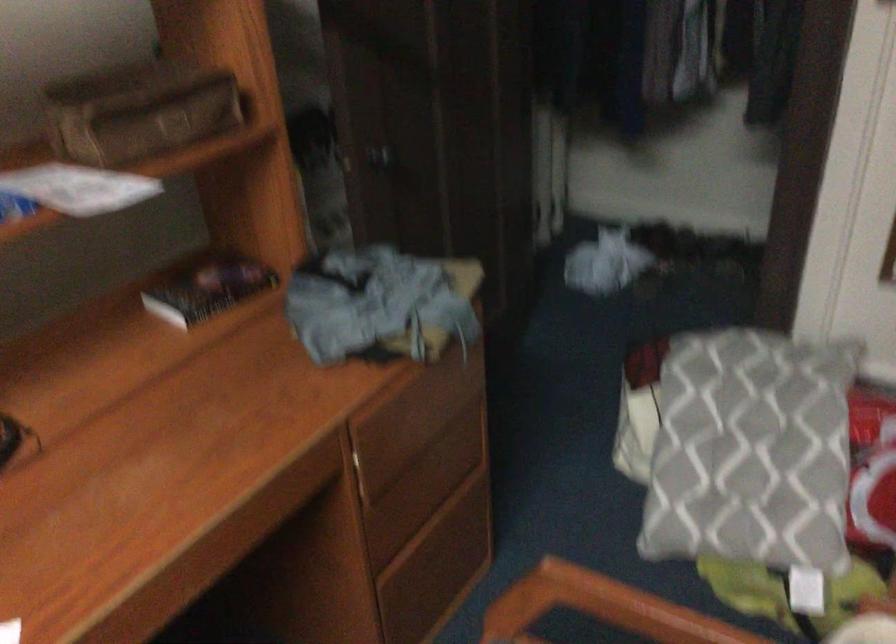
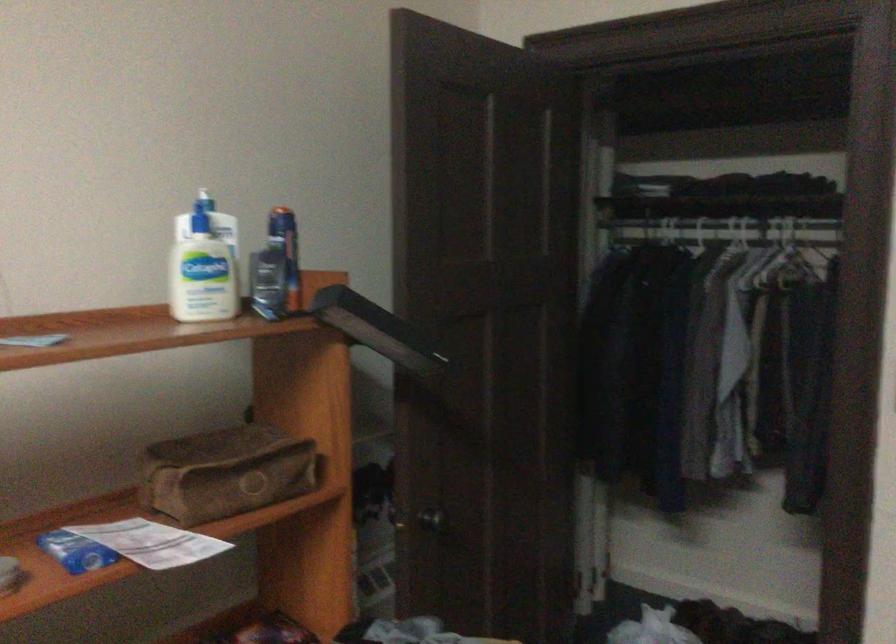
The point at (382, 152) is marked in the first image. Where is the corresponding point in the second image?

(433, 520)